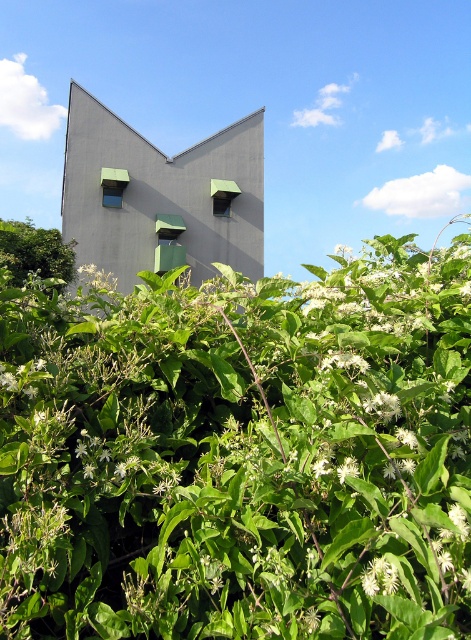
Question: Considering the real-world distances, which object is farthest from the white matte flower at lower center?

Choices:
 (A) green leafy hedge at left
 (B) green leafy hedge at center

Answer: (A)

Question: Can you confirm if green leafy hedge at center is wider than white matte flower at lower center?

Choices:
 (A) no
 (B) yes

Answer: (B)

Question: Among these points, which one is farthest from the camera?

Choices:
 (A) (367, 589)
 (B) (348, 460)
 (C) (10, 256)

Answer: (C)

Question: Is green leafy hedge at center thinner than white matte flower at lower center?

Choices:
 (A) yes
 (B) no

Answer: (B)

Question: Does green leafy hedge at left lie in front of white matte flower at lower center?

Choices:
 (A) no
 (B) yes

Answer: (A)

Question: Among these points, which one is farthest from the camera?

Choices:
 (A) (391, 592)
 (B) (356, 534)

Answer: (B)